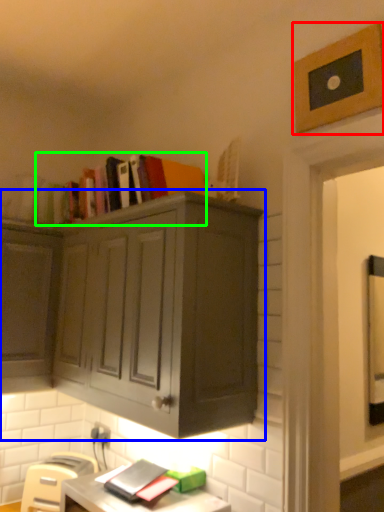
Question: Estimate the real-world distances between objects in this image. Which object is closer to picture frame (highlighted by a red box), cabinetry (highlighted by a blue box) or book (highlighted by a green box)?

Choices:
 (A) cabinetry
 (B) book

Answer: (B)